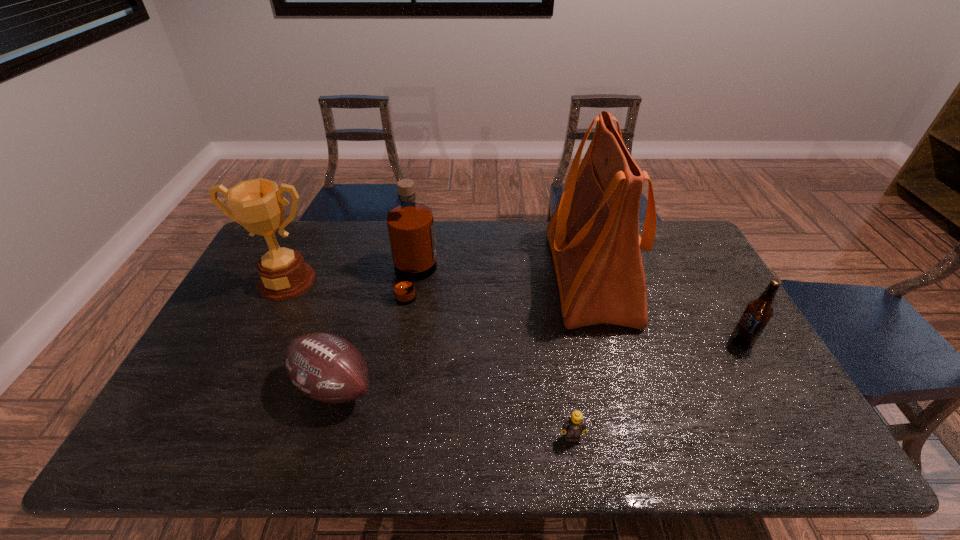
Image resolution: width=960 pixels, height=540 pixels. I want to click on shopping bag, so click(x=593, y=234).

Locate an element on the screen. This screenshot has height=540, width=960. the leftmost object is located at coordinates (258, 205).

Where is `liquor`? The height and width of the screenshot is (540, 960). liquor is located at coordinates (410, 225).

You are a GUI agent. You are given a task and a screenshot of the screen. Output one action in this format:
    pyautogui.click(x=<x>, y=<y>)
    Task: Click on the rightmost object
    
    Given the screenshot: What is the action you would take?
    pyautogui.click(x=758, y=312)

Where is `beer bottle`? The image size is (960, 540). beer bottle is located at coordinates (758, 312).

The width and height of the screenshot is (960, 540). What are the coordinates of `football (American)` in the screenshot? It's located at (325, 367).

You are a GUI agent. You are given a task and a screenshot of the screen. Output one action in this format:
    pyautogui.click(x=<x>, y=<y>)
    Task: Click on the fifth farthest object
    
    Given the screenshot: What is the action you would take?
    pyautogui.click(x=325, y=367)

Identify the location of Lego. (574, 426).

Find the location of `the shortest object`. the shortest object is located at coordinates (574, 426).

Locate an element on the screen. The image size is (960, 540). vacant area located 0.400m on the front pocket of the shopping bag is located at coordinates (425, 275).